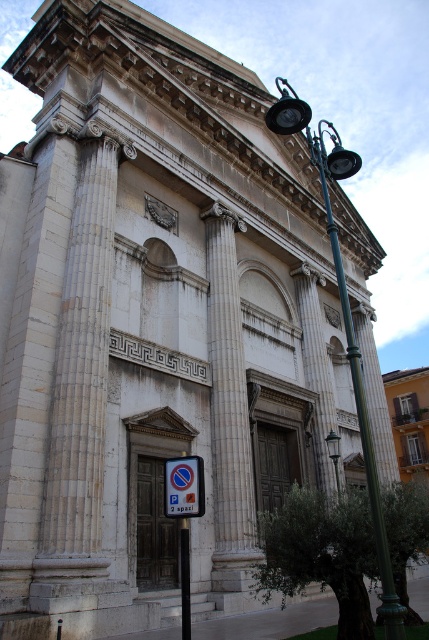
You are a driver trying to park your car in a parking lot. You see two parking signs, a white plastic parking sign at lower center and a blue plastic parking sign at lower center. Which parking sign is wider?

The white plastic parking sign at lower center might be wider than blue plastic parking sign at lower center according to the description.